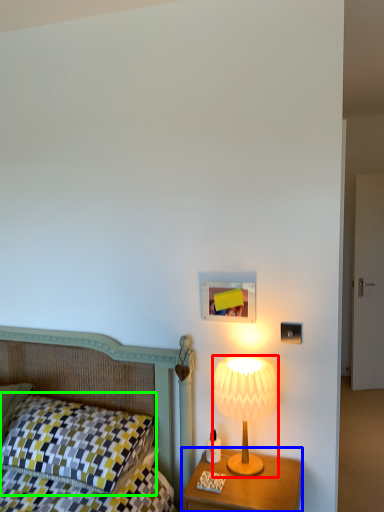
Question: Which is farther away from lamp (highlighted by a red box)? nightstand (highlighted by a blue box) or pillow (highlighted by a green box)?

Choices:
 (A) nightstand
 (B) pillow

Answer: (B)